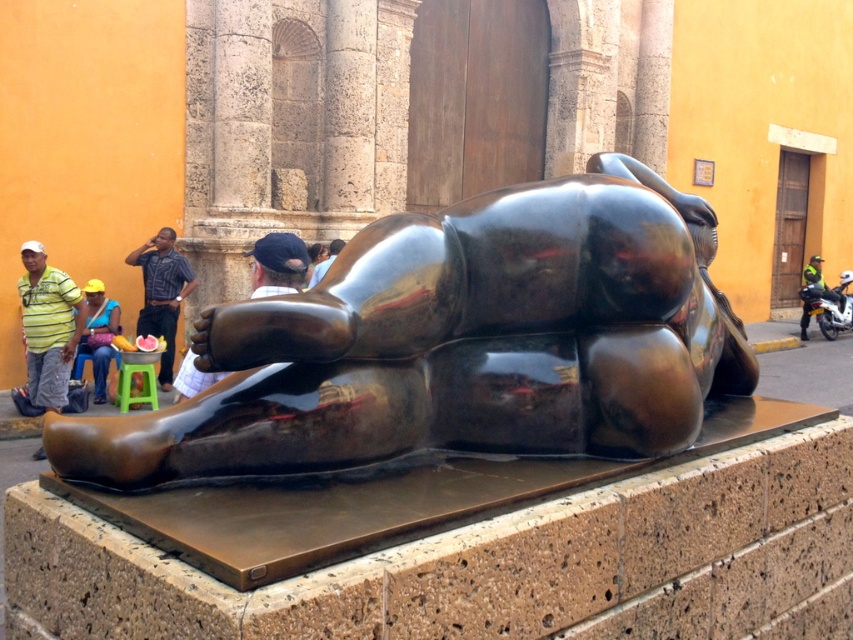
You are an artist observing the sculpture and notice the matte yellow hat at center and the matte black shirt at center. Which object is located below the other?

The matte yellow hat at center is positioned under the matte black shirt at center, so the matte yellow hat at center is below the matte black shirt at center.

You are standing in front of the sculpture and want to take a photo of the glossy bronze bear at center. If your camera has a minimum focusing distance of 8 feet, will you need to step back to take a clear photo?

The glossy bronze bear at center is 7.96 feet away from the viewer. Since the minimum focusing distance is 8 feet, you are slightly too close. You need to step back a small distance to ensure the camera can focus properly.